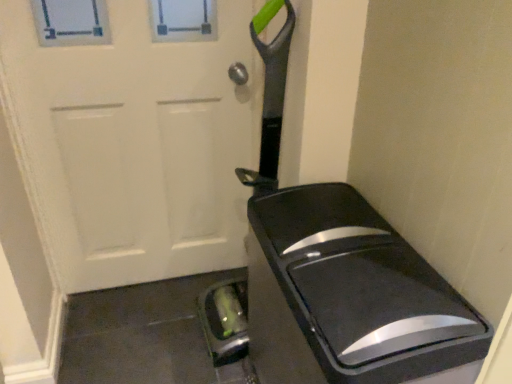
Question: From a real-world perspective, does black glossy trash can at center sit lower than white matte door at center?

Choices:
 (A) no
 (B) yes

Answer: (B)

Question: Is black glossy trash can at center oriented away from white matte door at center?

Choices:
 (A) yes
 (B) no

Answer: (B)

Question: Is black glossy trash can at center not close to white matte door at center?

Choices:
 (A) yes
 (B) no

Answer: (B)

Question: Considering the relative sizes of black glossy trash can at center and white matte door at center in the image provided, is black glossy trash can at center wider than white matte door at center?

Choices:
 (A) yes
 (B) no

Answer: (A)

Question: Considering the relative sizes of black glossy trash can at center and white matte door at center in the image provided, is black glossy trash can at center bigger than white matte door at center?

Choices:
 (A) no
 (B) yes

Answer: (B)

Question: Is black glossy trash can at center at the left side of white matte door at center?

Choices:
 (A) yes
 (B) no

Answer: (B)

Question: Does white matte door at center have a greater width compared to black glossy trash can at center?

Choices:
 (A) no
 (B) yes

Answer: (A)

Question: Does white matte door at center appear on the right side of black glossy trash can at center?

Choices:
 (A) no
 (B) yes

Answer: (A)

Question: Does white matte door at center have a larger size compared to black glossy trash can at center?

Choices:
 (A) yes
 (B) no

Answer: (B)

Question: Is the position of white matte door at center more distant than that of black glossy trash can at center?

Choices:
 (A) yes
 (B) no

Answer: (A)

Question: From a real-world perspective, is white matte door at center over black glossy trash can at center?

Choices:
 (A) no
 (B) yes

Answer: (B)

Question: Can you confirm if white matte door at center is positioned to the left of black glossy trash can at center?

Choices:
 (A) yes
 (B) no

Answer: (A)

Question: Considering the relative positions of white matte door at center and black glossy trash can at center in the image provided, is white matte door at center to the left or to the right of black glossy trash can at center?

Choices:
 (A) left
 (B) right

Answer: (A)